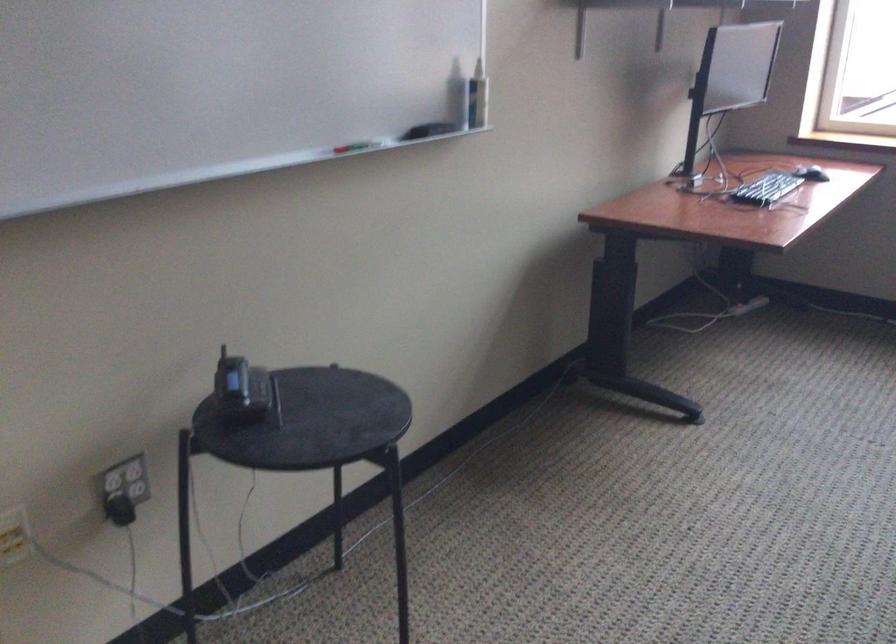
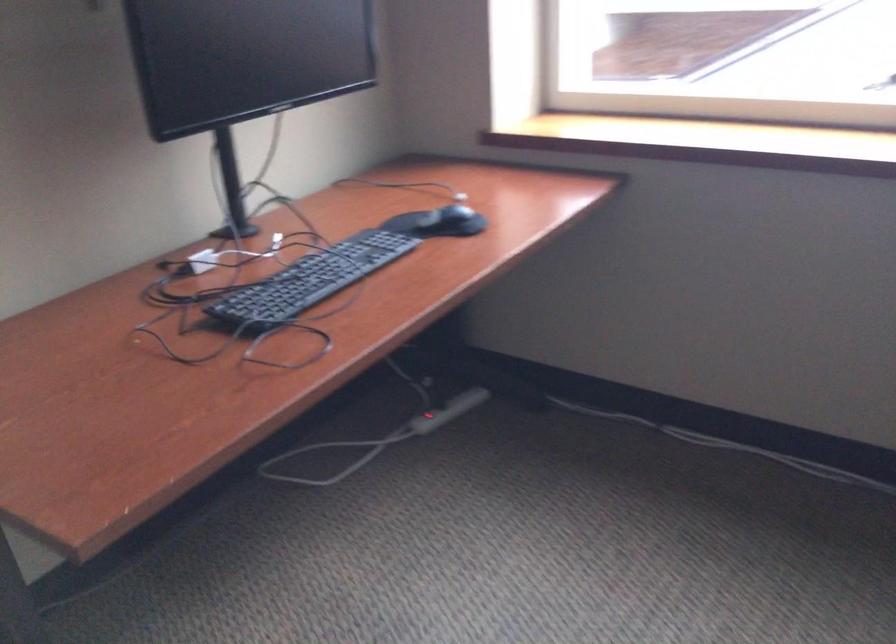
Question: I am providing you with two images of the same scene from different viewpoints. After the viewpoint changes to image2, which objects are now occluded?

Choices:
 (A) white power adapter
 (B) black keyboard
 (C) black computer mouse
 (D) none of these

Answer: (D)